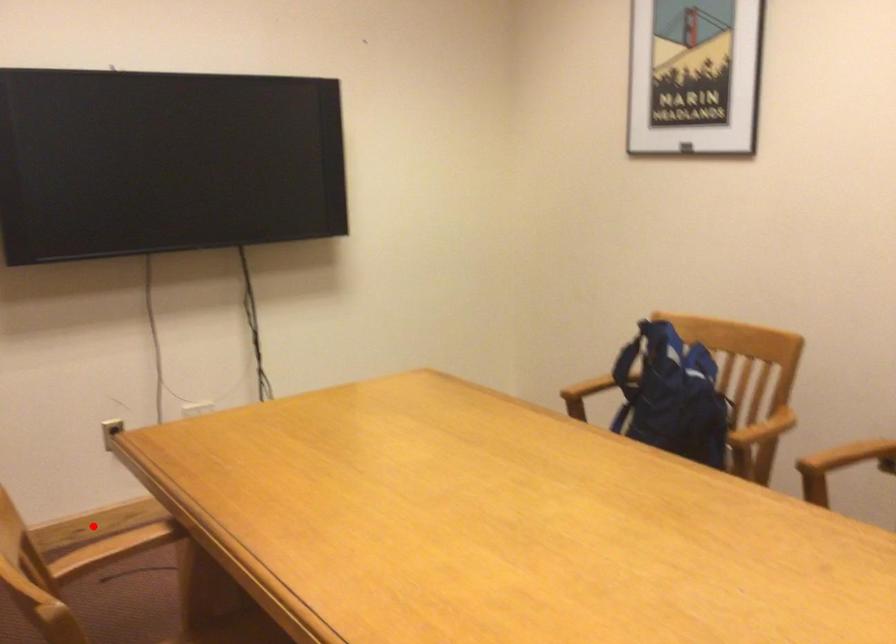
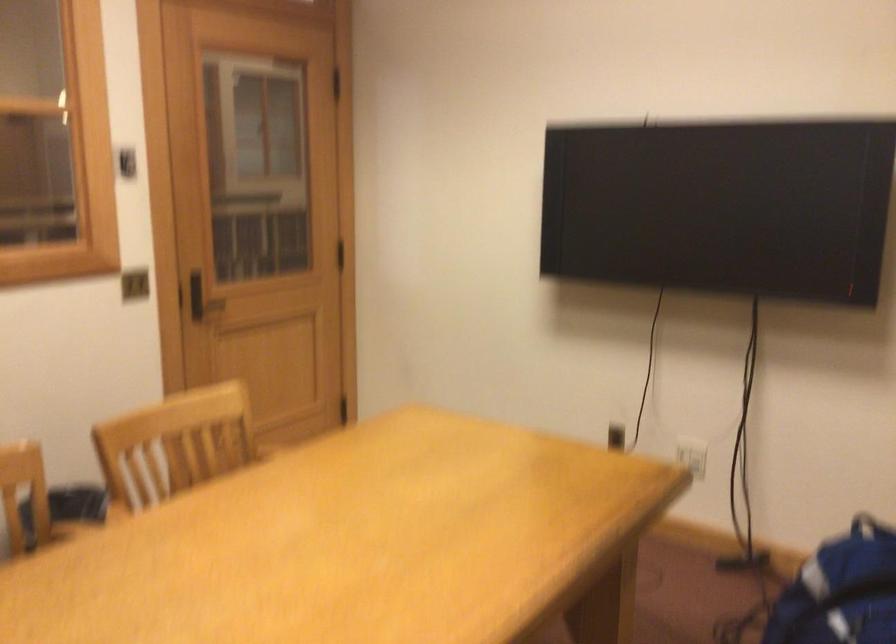
Question: I am providing you with two images of the same scene from different viewpoints. A red point is marked on the first image. Is the red point's position out of view in image 2?

Choices:
 (A) Yes
 (B) No

Answer: (A)